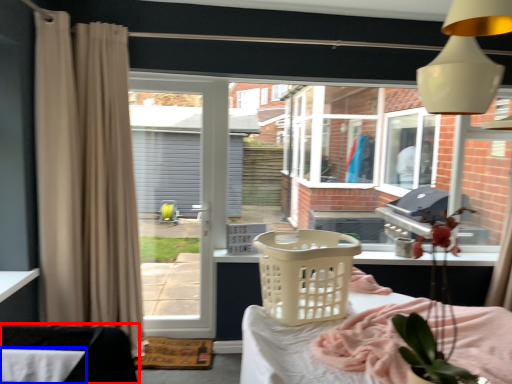
Question: Which point is closer to the camera, furniture (highlighted by a red box) or table (highlighted by a blue box)?

Choices:
 (A) furniture
 (B) table

Answer: (B)